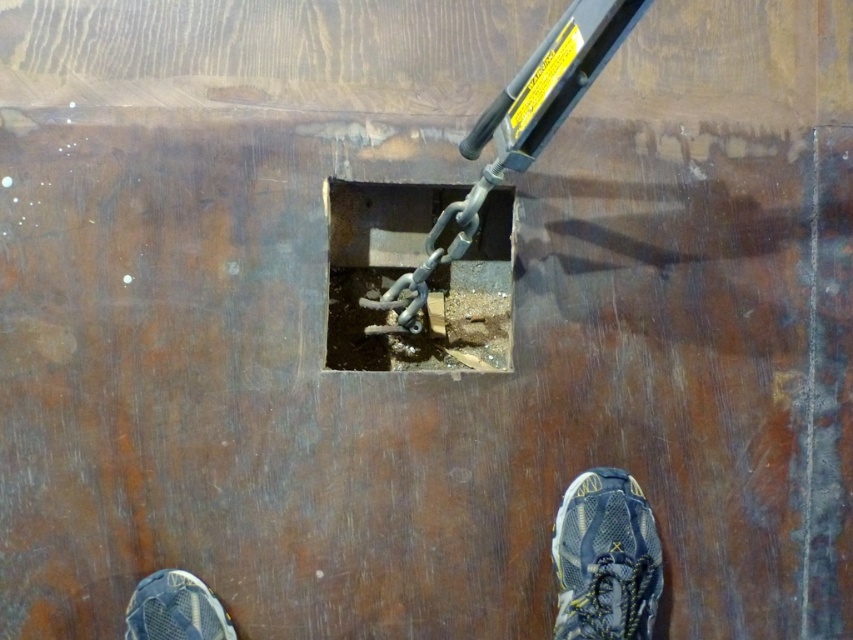
You are standing on the wooden floor and see the rusty metal hole at center and the blue mesh shoe at lower left. You want to place a 16 inch long tool between them. Will it fit?

The rusty metal hole at center and blue mesh shoe at lower left are 15.81 inches apart from each other. Since the tool is 16 inches long, it will not fit between them as the distance is slightly shorter than the tool.

You are standing on the wooden floor and notice a point at coordinates (x=410, y=269). What object is located at that point?

The point at coordinates (x=410, y=269) corresponds to the rusty metal hole at center.